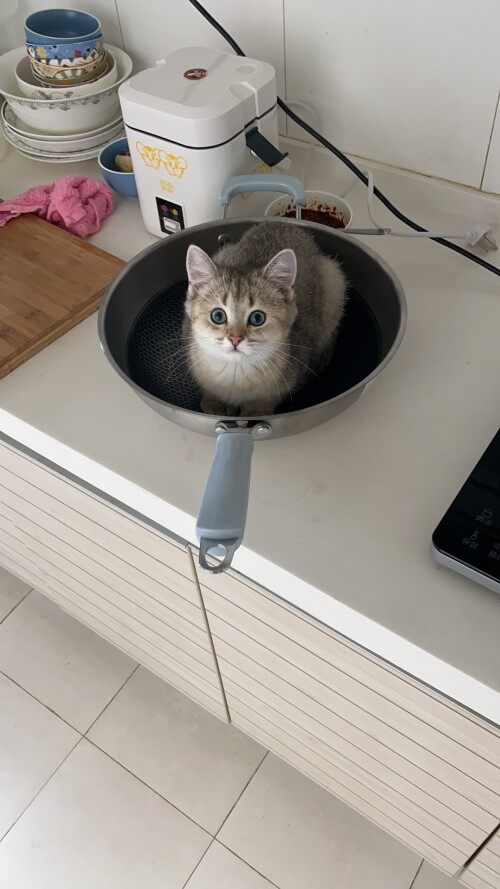
Locate all where to pick up the frying pan from in the image. Your answer should be formatted as a list of tuples, i.e. [(x1, y1), (x2, y2), ...], where each tuple contains the x and y coordinates of a point satisfying the conditions above.

[(229, 530)]